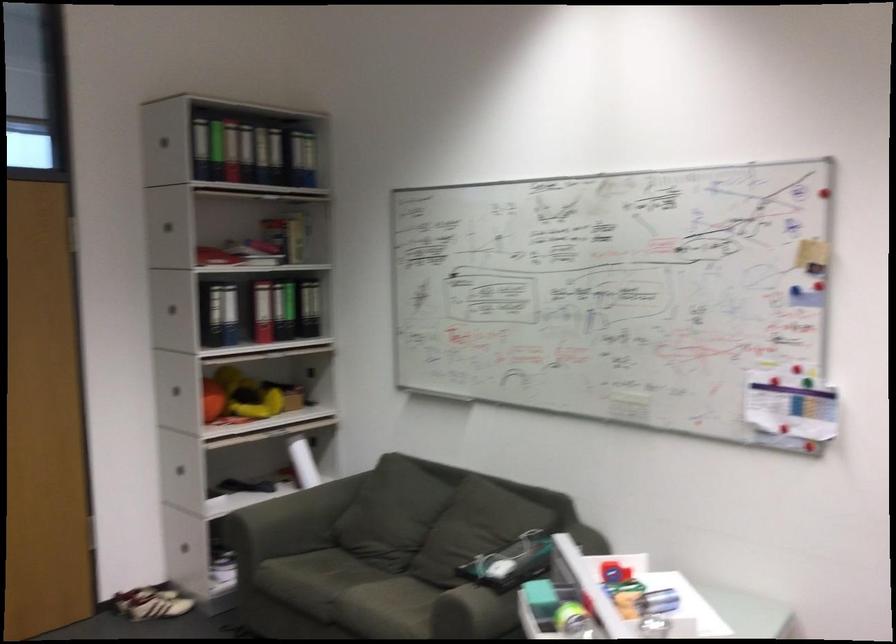
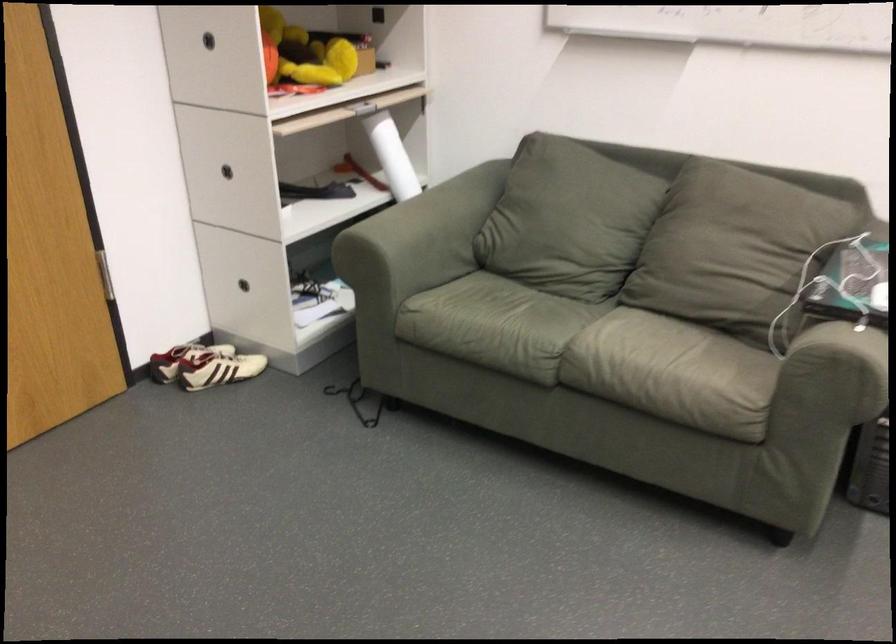
Find the pixel in the second image that matches point (297, 471) in the first image.

(392, 156)